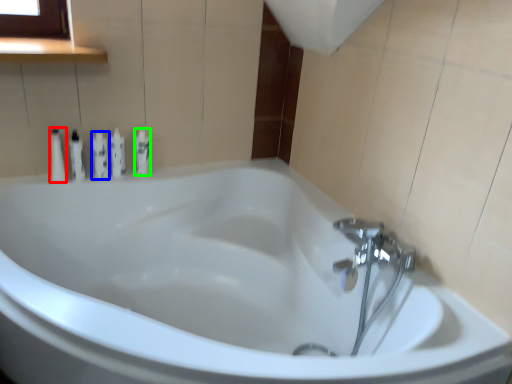
Question: Considering the real-world distances, which object is farthest from toiletry (highlighted by a red box)? toiletry (highlighted by a blue box) or toiletry (highlighted by a green box)?

Choices:
 (A) toiletry
 (B) toiletry

Answer: (B)